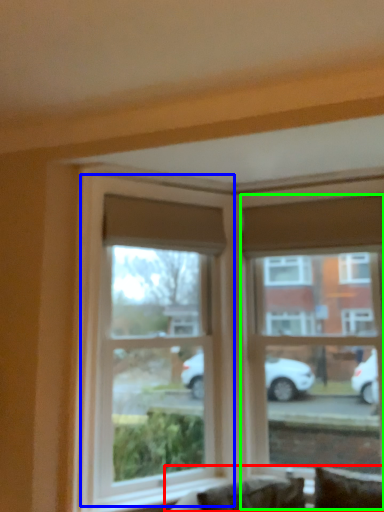
Question: Considering the real-world distances, which object is farthest from couch (highlighted by a red box)? window (highlighted by a blue box) or window (highlighted by a green box)?

Choices:
 (A) window
 (B) window

Answer: (B)